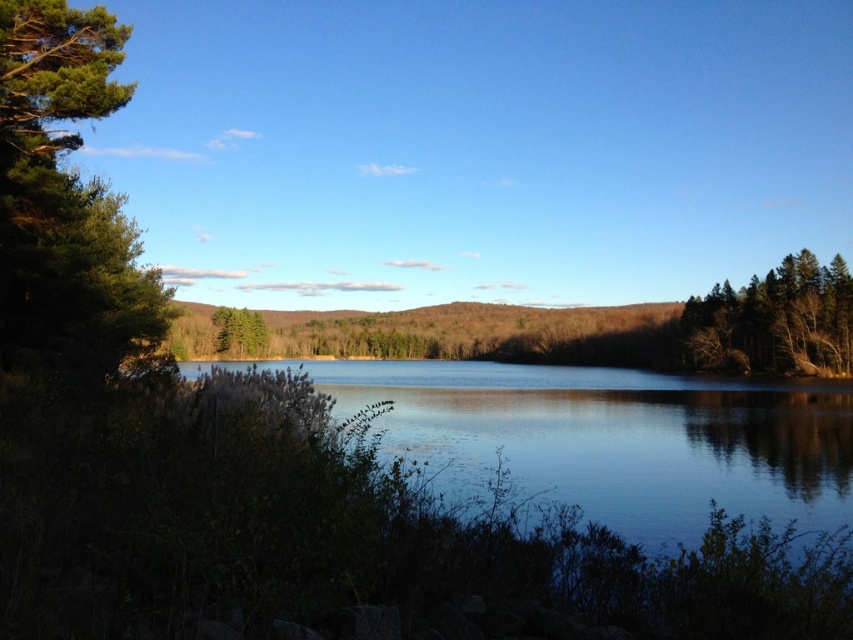
This screenshot has height=640, width=853. What do you see at coordinates (606, 440) in the screenshot?
I see `clear water at center` at bounding box center [606, 440].

At what (x,y) coordinates should I click in order to perform the action: click on clear water at center. Please return your answer as a coordinate pair (x, y). Image resolution: width=853 pixels, height=640 pixels. Looking at the image, I should click on (606, 440).

Can you confirm if clear water at center is positioned to the left of green matte tree at right?

Correct, you'll find clear water at center to the left of green matte tree at right.

Can you confirm if clear water at center is smaller than green matte tree at right?

Actually, clear water at center might be larger than green matte tree at right.

You are a GUI agent. You are given a task and a screenshot of the screen. Output one action in this format:
    pyautogui.click(x=<x>, y=<y>)
    Task: Click on the clear water at center
    The width and height of the screenshot is (853, 640).
    Given the screenshot: What is the action you would take?
    pyautogui.click(x=606, y=440)

Based on the photo, can you confirm if green matte tree at right is positioned to the left of green matte tree at center-left?

In fact, green matte tree at right is to the right of green matte tree at center-left.

Is point (778, 298) positioned after point (251, 353)?

No, it is not.

At what (x,y) coordinates should I click in order to perform the action: click on green matte tree at right. Please return your answer as a coordinate pair (x, y). The image size is (853, 640). Looking at the image, I should click on (775, 321).